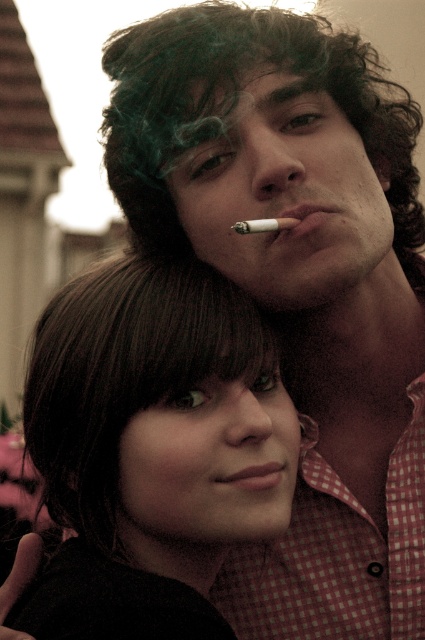
You are an interior designer planning to place a decorative item between the woman in the foreground and the man in the background. The green curly wig at upper center is already placed at coordinates point 0.163, 0.548. Can you determine if the wig is positioned between them?

The green curly wig at upper center is located at point (232, 104), which is between the woman in the foreground and the man in the background, so yes, it is positioned between them.

You are a photographer trying to capture the cigarette smoke in the image. You notice two cigarettes, a matte cigarette at center and a white matte cigarette at upper center. Which cigarette is bigger?

The matte cigarette at center is larger than the white matte cigarette at upper center.

What are the coordinates of the matte cigarette at center in the image?

The coordinates of the matte cigarette at center are at point (305, 218).